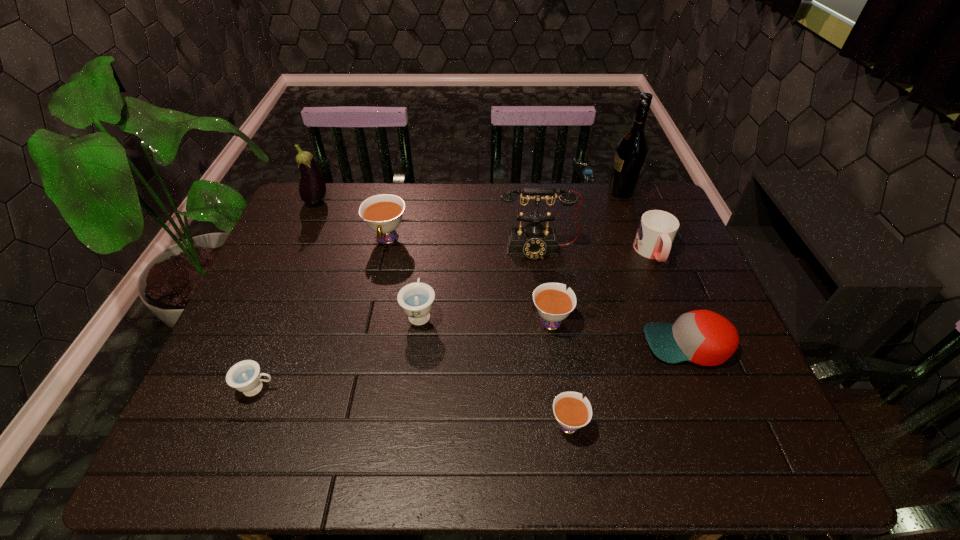
The image size is (960, 540). I want to click on free region at the near left corner of the desktop, so (181, 442).

Find the location of a particular element. The width and height of the screenshot is (960, 540). free space at the far right corner of the desktop is located at coordinates (652, 203).

The width and height of the screenshot is (960, 540). I want to click on vacant area at the near right corner, so click(722, 447).

Where is `empty space that is in between the mug and the nearer blue teacup`? The image size is (960, 540). empty space that is in between the mug and the nearer blue teacup is located at coordinates (455, 320).

The image size is (960, 540). I want to click on vacant space that's between the smallest white teacup and the telephone, so click(x=553, y=335).

Find the location of a particular element. This screenshot has width=960, height=540. empty space that is in between the red baseball cap and the black wine bottle is located at coordinates (654, 268).

The height and width of the screenshot is (540, 960). What are the coordinates of `free area in between the tallest object and the mug` in the screenshot? It's located at (636, 222).

You are a GUI agent. You are given a task and a screenshot of the screen. Output one action in this format:
    pyautogui.click(x=<x>, y=<y>)
    Task: Click on the empty space that is in between the left blue teacup and the farthest white teacup
    This screenshot has width=960, height=540.
    Given the screenshot: What is the action you would take?
    pyautogui.click(x=323, y=314)

Where is `vacant point located between the mug and the eggplant`? The width and height of the screenshot is (960, 540). vacant point located between the mug and the eggplant is located at coordinates (485, 227).

You are a GUI agent. You are given a task and a screenshot of the screen. Output one action in this format:
    pyautogui.click(x=<x>, y=<y>)
    Task: Click on the vacant area that lies between the farthest white teacup and the smallest white teacup
    The image size is (960, 540).
    Given the screenshot: What is the action you would take?
    pyautogui.click(x=477, y=330)